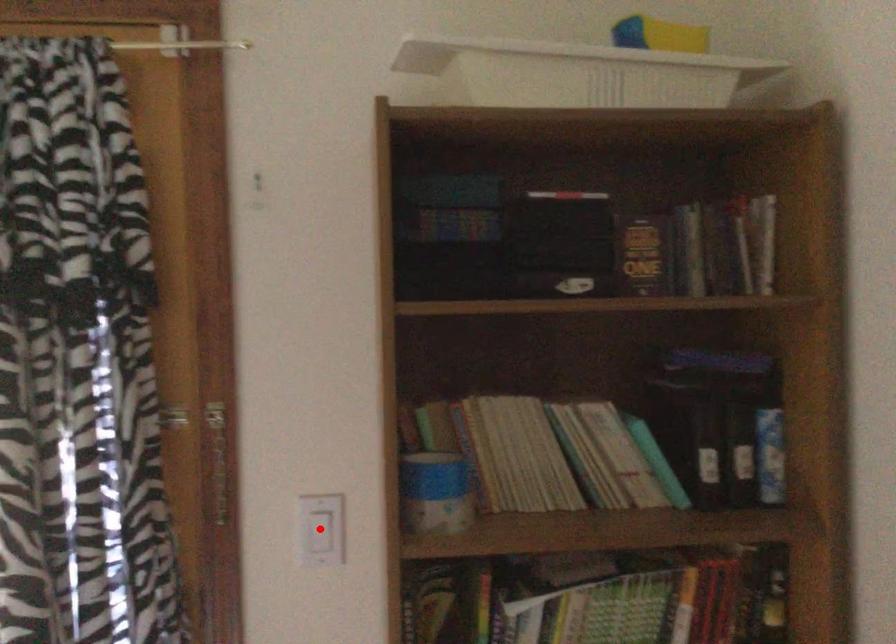
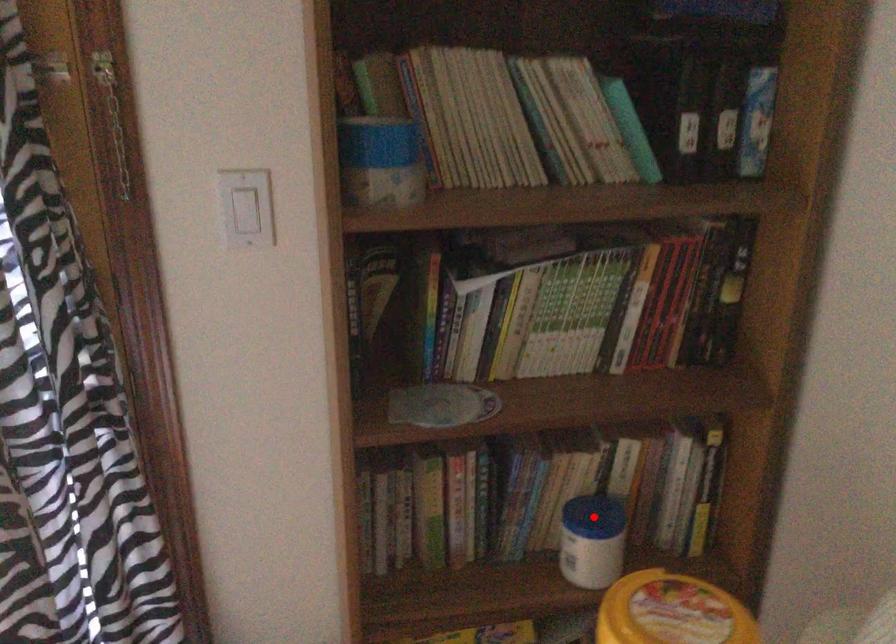
I am providing you with two images of the same scene from different viewpoints. A red point is marked on the first image and another point is marked on the second image. Do the highlighted points in image1 and image2 indicate the same real-world spot?

No